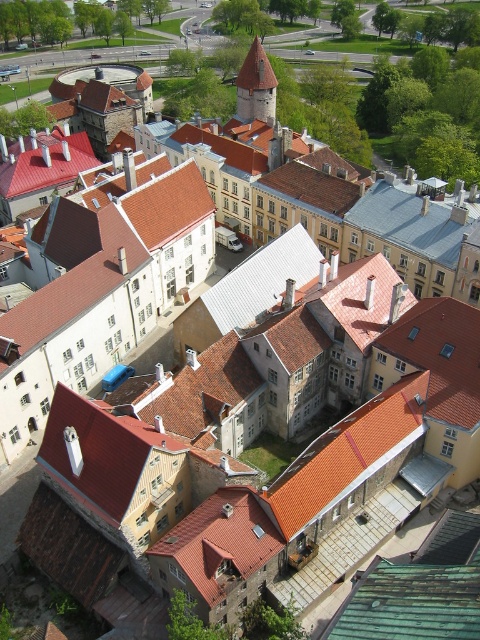
Question: Does green shingles at center appear on the left side of brown stone tower at center?

Choices:
 (A) no
 (B) yes

Answer: (A)

Question: Estimate the real-world distances between objects in this image. Which object is farther from the orange tile roof at center?

Choices:
 (A) green shingles at center
 (B) brown stone tower at center

Answer: (B)

Question: Which of these objects is positioned farthest from the orange tile roof at center?

Choices:
 (A) green shingles at center
 (B) brown stone tower at center

Answer: (B)

Question: Does green shingles at center appear under brown stone tower at center?

Choices:
 (A) no
 (B) yes

Answer: (B)

Question: Is orange tile roof at center bigger than green shingles at center?

Choices:
 (A) yes
 (B) no

Answer: (A)

Question: Which object is the farthest from the brown stone tower at center?

Choices:
 (A) green shingles at center
 (B) orange tile roof at center

Answer: (A)